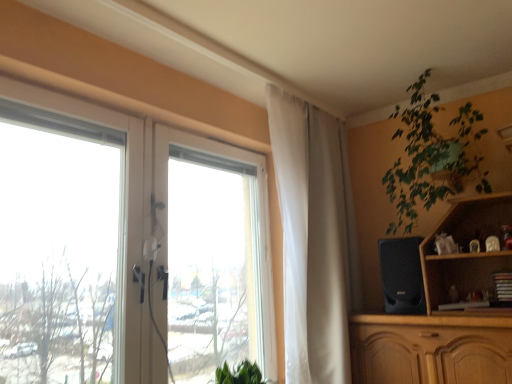
Question: Is transparent glass window at left closer to camera compared to green leafy plant at upper right?

Choices:
 (A) yes
 (B) no

Answer: (A)

Question: From a real-world perspective, is transparent glass window at left physically above green leafy plant at upper right?

Choices:
 (A) yes
 (B) no

Answer: (B)

Question: Is transparent glass window at left smaller than green leafy plant at upper right?

Choices:
 (A) yes
 (B) no

Answer: (B)

Question: Is transparent glass window at left turned away from green leafy plant at upper right?

Choices:
 (A) no
 (B) yes

Answer: (A)

Question: Is transparent glass window at left outside green leafy plant at upper right?

Choices:
 (A) no
 (B) yes

Answer: (B)

Question: Is black matte speaker at right bigger or smaller than transparent glass window at left?

Choices:
 (A) big
 (B) small

Answer: (B)

Question: Based on their positions, is black matte speaker at right located to the left or right of transparent glass window at left?

Choices:
 (A) right
 (B) left

Answer: (A)

Question: Does point (415, 261) appear closer or farther from the camera than point (216, 150)?

Choices:
 (A) closer
 (B) farther

Answer: (A)

Question: Considering the positions of black matte speaker at right and transparent glass window at left in the image, is black matte speaker at right wider or thinner than transparent glass window at left?

Choices:
 (A) thin
 (B) wide

Answer: (B)

Question: Considering their positions, is transparent glass window at left located in front of or behind white sheer curtain at upper center?

Choices:
 (A) behind
 (B) front

Answer: (B)

Question: Considering the positions of transparent glass window at left and white sheer curtain at upper center in the image, is transparent glass window at left taller or shorter than white sheer curtain at upper center?

Choices:
 (A) tall
 (B) short

Answer: (B)

Question: Considering the relative positions of transparent glass window at left and white sheer curtain at upper center in the image provided, is transparent glass window at left to the left or to the right of white sheer curtain at upper center?

Choices:
 (A) right
 (B) left

Answer: (B)

Question: In terms of width, does transparent glass window at left look wider or thinner when compared to white sheer curtain at upper center?

Choices:
 (A) thin
 (B) wide

Answer: (A)

Question: Visually, is green leafy plant at upper right positioned to the left or to the right of transparent glass window at left?

Choices:
 (A) left
 (B) right

Answer: (B)

Question: Is green leafy plant at upper right wider or thinner than transparent glass window at left?

Choices:
 (A) wide
 (B) thin

Answer: (A)